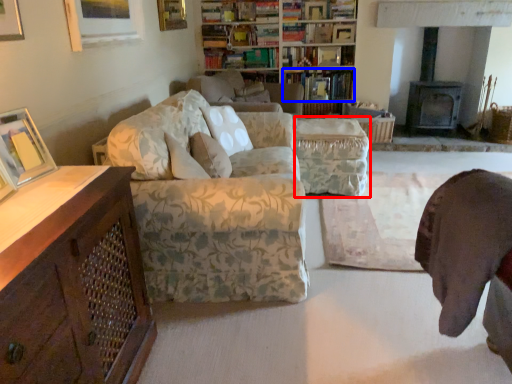
Question: Which object appears farthest to the camera in this image, footrest (highlighted by a red box) or book (highlighted by a blue box)?

Choices:
 (A) footrest
 (B) book

Answer: (B)